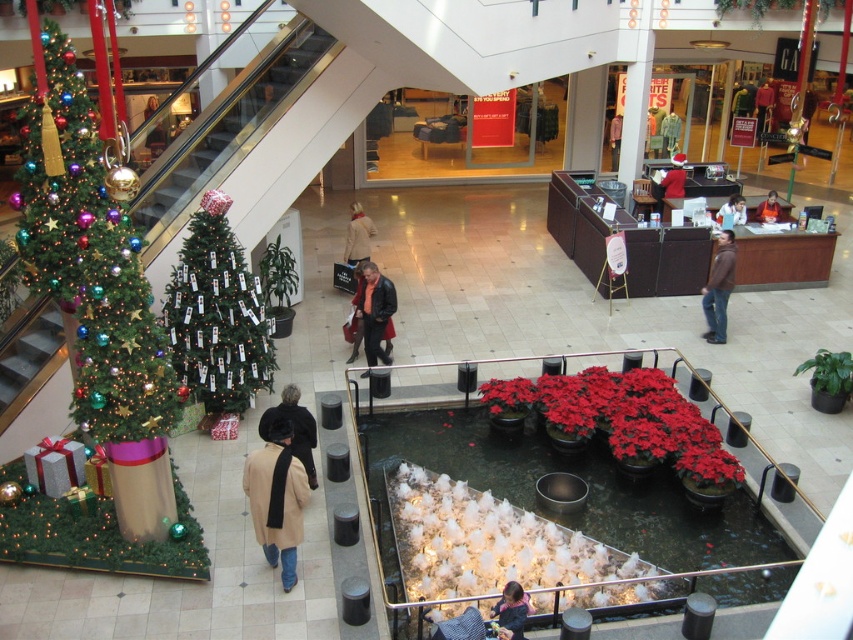
Can you confirm if metallic glass escalator at upper left is wider than beige wool coat at lower center?

Correct, the width of metallic glass escalator at upper left exceeds that of beige wool coat at lower center.

Is metallic glass escalator at upper left shorter than beige wool coat at lower center?

No.

Image resolution: width=853 pixels, height=640 pixels. Describe the element at coordinates (230, 128) in the screenshot. I see `metallic glass escalator at upper left` at that location.

Where is `metallic glass escalator at upper left`? metallic glass escalator at upper left is located at coordinates (230, 128).

Which is more to the left, beige wool coat at lower center or dark blue sweater at lower center?

beige wool coat at lower center

Which is more to the right, beige wool coat at lower center or dark blue sweater at lower center?

From the viewer's perspective, dark blue sweater at lower center appears more on the right side.

Is point (281, 435) more distant than point (519, 588)?

Yes.

Find the location of `beige wool coat at lower center`. beige wool coat at lower center is located at coordinates (277, 499).

Who is higher up, metallic glass escalator at upper left or dark blue sweater at lower center?

Positioned higher is metallic glass escalator at upper left.

Is metallic glass escalator at upper left taller than dark blue sweater at lower center?

Indeed, metallic glass escalator at upper left has a greater height compared to dark blue sweater at lower center.

Is point (230, 120) positioned in front of point (511, 605)?

No, it is behind (511, 605).

Identify the location of metallic glass escalator at upper left. (230, 128).